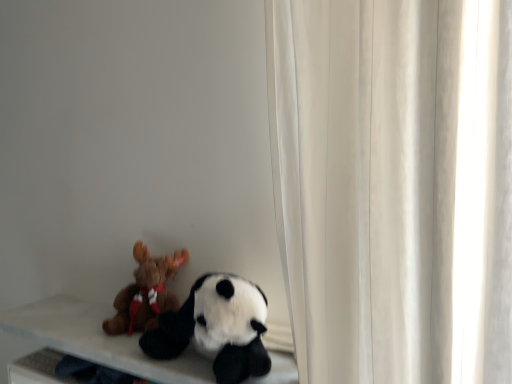
Question: From the image's perspective, would you say brown plush moose at left, arranged as the 1th toy when viewed from the left, is shown under soft white table at lower left?

Choices:
 (A) yes
 (B) no

Answer: (B)

Question: Is brown plush moose at left, the 2th toy when ordered from right to left, located outside soft white table at lower left?

Choices:
 (A) yes
 (B) no

Answer: (A)

Question: Is brown plush moose at left, the 2th toy when ordered from right to left, wider than soft white table at lower left?

Choices:
 (A) no
 (B) yes

Answer: (A)

Question: Does brown plush moose at left, the 2th toy when ordered from right to left, touch soft white table at lower left?

Choices:
 (A) no
 (B) yes

Answer: (A)

Question: Considering the relative sizes of brown plush moose at left, arranged as the 1th toy when viewed from the left, and soft white table at lower left in the image provided, is brown plush moose at left, arranged as the 1th toy when viewed from the left, smaller than soft white table at lower left?

Choices:
 (A) yes
 (B) no

Answer: (A)

Question: Does point (0, 321) appear closer or farther from the camera than point (205, 281)?

Choices:
 (A) closer
 (B) farther

Answer: (B)

Question: In the image, is soft white table at lower left positioned in front of or behind soft plush panda at lower left, placed as the 2th toy when sorted from left to right?

Choices:
 (A) front
 (B) behind

Answer: (B)

Question: From a real-world perspective, is soft white table at lower left above or below soft plush panda at lower left, placed as the 2th toy when sorted from left to right?

Choices:
 (A) below
 (B) above

Answer: (A)

Question: Considering the relative positions of soft white table at lower left and soft plush panda at lower left, arranged as the first toy when viewed from the right, in the image provided, is soft white table at lower left to the left or to the right of soft plush panda at lower left, arranged as the first toy when viewed from the right,?

Choices:
 (A) left
 (B) right

Answer: (A)

Question: Is point (130, 304) closer or farther from the camera than point (212, 332)?

Choices:
 (A) closer
 (B) farther

Answer: (B)

Question: Is brown plush moose at left, the 2th toy when ordered from right to left, wider or thinner than soft plush panda at lower left, placed as the 2th toy when sorted from left to right?

Choices:
 (A) thin
 (B) wide

Answer: (A)

Question: Is brown plush moose at left, the 2th toy when ordered from right to left, inside or outside of soft plush panda at lower left, placed as the 2th toy when sorted from left to right?

Choices:
 (A) inside
 (B) outside

Answer: (B)

Question: From the image's perspective, is brown plush moose at left, the 2th toy when ordered from right to left, above or below soft plush panda at lower left, arranged as the first toy when viewed from the right?

Choices:
 (A) below
 (B) above

Answer: (B)

Question: From the image's perspective, is brown plush moose at left, the 2th toy when ordered from right to left, positioned above or below soft white table at lower left?

Choices:
 (A) above
 (B) below

Answer: (A)

Question: Looking at the image, does brown plush moose at left, arranged as the 1th toy when viewed from the left, seem bigger or smaller compared to soft white table at lower left?

Choices:
 (A) big
 (B) small

Answer: (B)